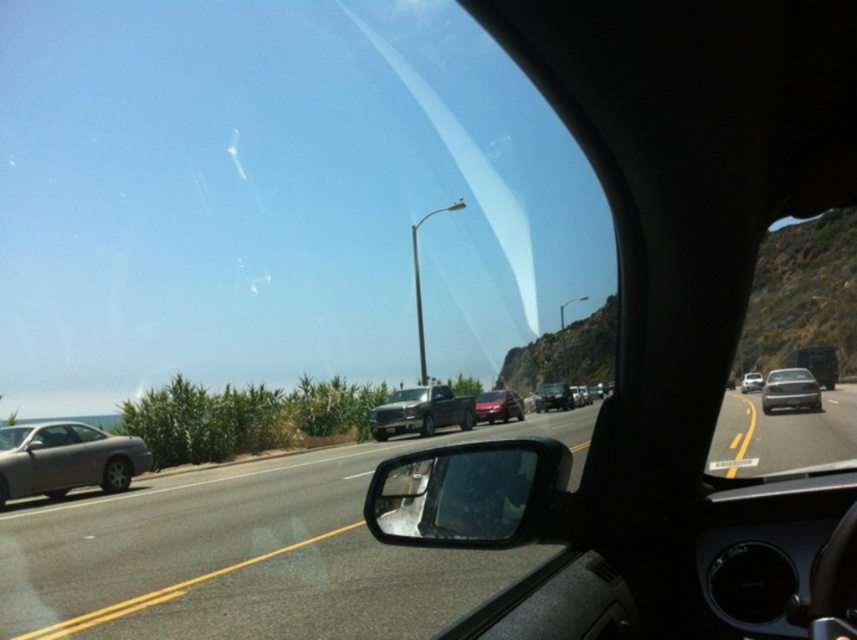
Question: Is satin silver sedan at right behind black matte sedan at center?

Choices:
 (A) yes
 (B) no

Answer: (B)

Question: Considering the relative positions of black glossy sedan at center and matte black truck at center in the image provided, where is black glossy sedan at center located with respect to matte black truck at center?

Choices:
 (A) below
 (B) above

Answer: (B)

Question: Which of these objects is positioned farthest from the black glossy rearview mirror at lower right?

Choices:
 (A) gray asphalt road at center
 (B) satin silver sedan at left

Answer: (B)

Question: Among these points, which one is nearest to the camera?

Choices:
 (A) (78, 442)
 (B) (537, 404)
 (C) (456, 560)

Answer: (C)

Question: Among these points, which one is farthest from the camera?

Choices:
 (A) (x=800, y=381)
 (B) (x=114, y=467)
 (C) (x=746, y=372)
 (D) (x=715, y=472)

Answer: (C)

Question: Is black matte sedan at center thinner than metallic silver sedan at right?

Choices:
 (A) no
 (B) yes

Answer: (B)